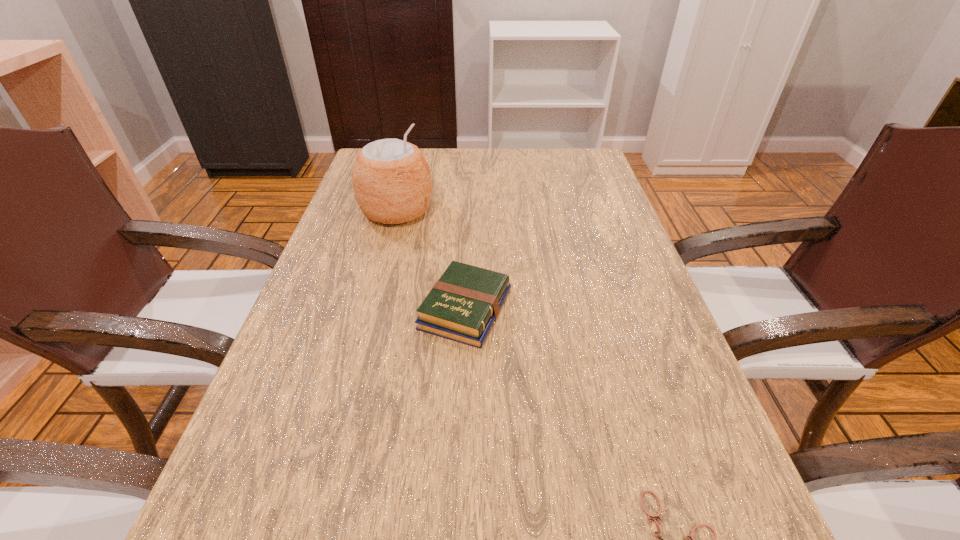
This screenshot has height=540, width=960. I want to click on vacant space that is in between the second farthest object and the coconut, so click(431, 260).

Locate an element on the screen. the closest object relative to the second shortest object is located at coordinates (462, 306).

Image resolution: width=960 pixels, height=540 pixels. Identify the location of object that is the second closest one to the tallest object. click(331, 539).